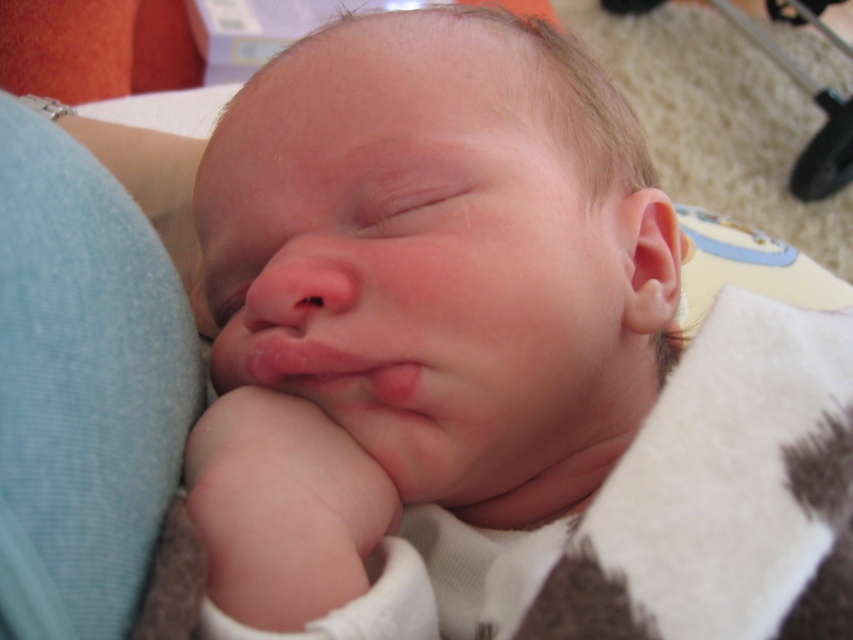
Can you confirm if smooth skin newborn at center is positioned above metallic silver stroller at upper right?

Actually, smooth skin newborn at center is below metallic silver stroller at upper right.

Who is shorter, smooth skin newborn at center or metallic silver stroller at upper right?

smooth skin newborn at center is shorter.

Is point (640, 140) positioned after point (602, 4)?

No, (640, 140) is in front of (602, 4).

This screenshot has height=640, width=853. I want to click on smooth skin newborn at center, so click(416, 298).